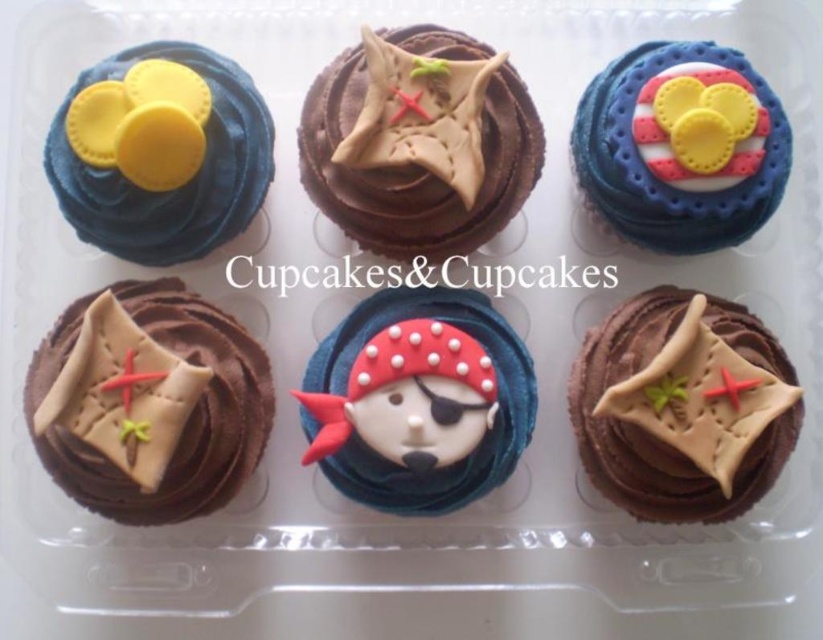
Which is behind, point (424, 109) or point (49, 179)?

The point (49, 179) is more distant.

Locate an element on the screen. chocolate matte pirate flag at center is located at coordinates click(x=419, y=141).

You are a GUI agent. You are given a task and a screenshot of the screen. Output one action in this format:
    pyautogui.click(x=<x>, y=<y>)
    Task: Click on the chocolate matte pirate flag at center
    
    Given the screenshot: What is the action you would take?
    pyautogui.click(x=419, y=141)

Can you confirm if chocolate matte paper at center is bigger than chocolate matte pirate flag at center right?

Indeed, chocolate matte paper at center has a larger size compared to chocolate matte pirate flag at center right.

Which is above, chocolate matte paper at center or chocolate matte pirate flag at center right?

chocolate matte paper at center is higher up.

Locate an element on the screen. chocolate matte paper at center is located at coordinates (147, 403).

At what (x,y) coordinates should I click in order to perform the action: click on chocolate matte paper at center. Please return your answer as a coordinate pair (x, y). This screenshot has width=823, height=640. Looking at the image, I should click on (147, 403).

Is chocolate matte paper at center bigger than matte chocolate cupcake at center?

Yes.

At what (x,y) coordinates should I click in order to perform the action: click on chocolate matte paper at center. Please return your answer as a coordinate pair (x, y). Looking at the image, I should click on (147, 403).